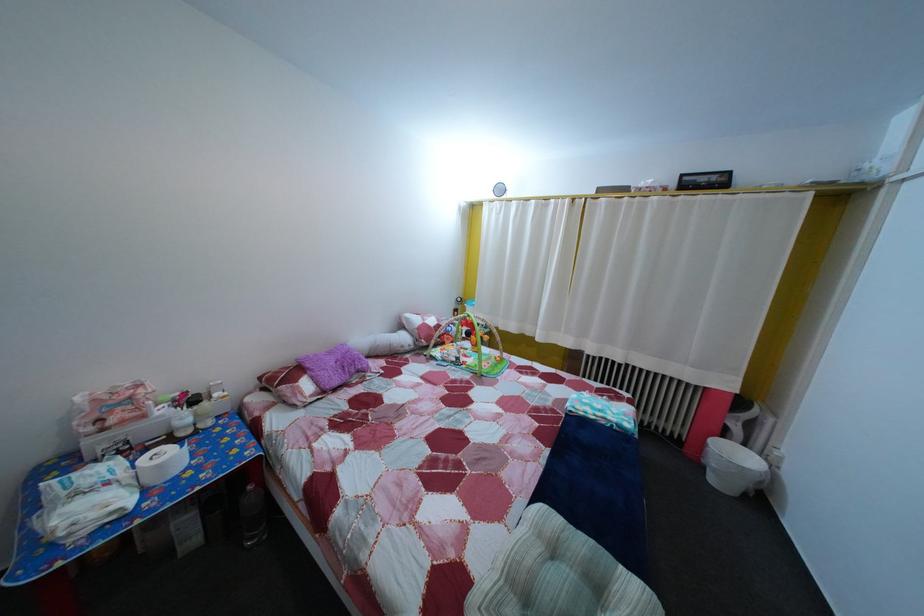
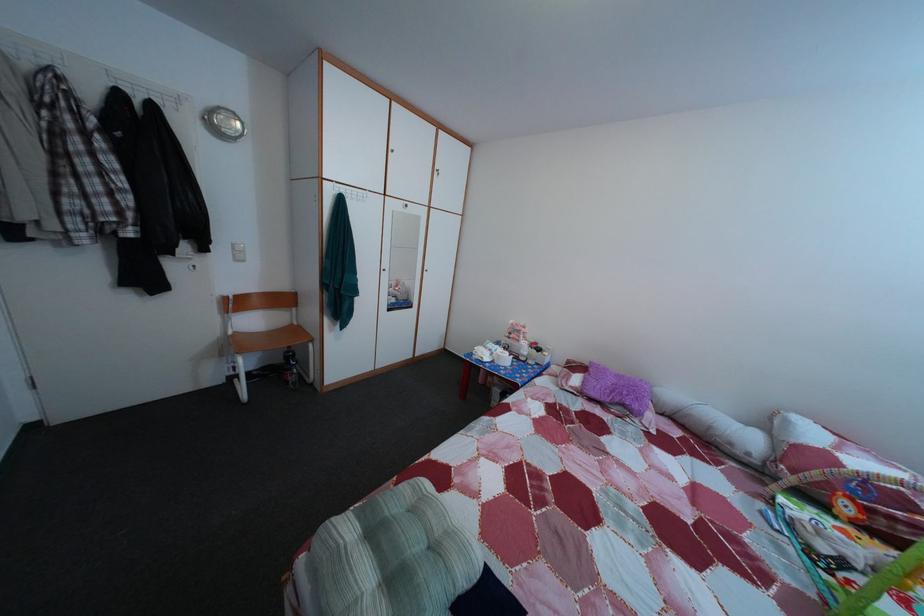
In the second image, find the point that corresponds to pixel 366 384 in the first image.

(628, 416)